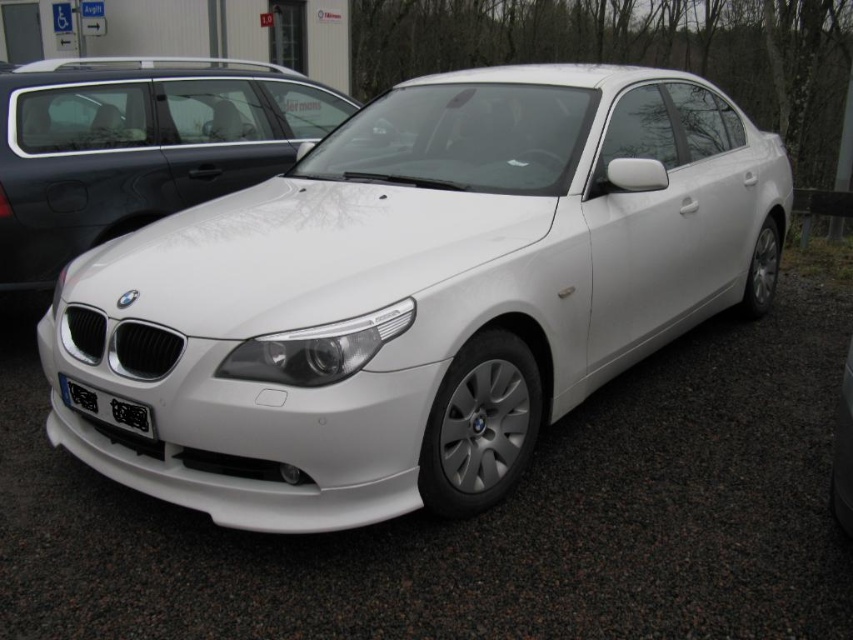
In the scene shown: Does white metallic car at center have a larger size compared to white glossy car at center?

Yes, white metallic car at center is bigger than white glossy car at center.

Does point (157, 410) lie in front of point (695, 380)?

That is True.

Locate an element on the screen. white metallic car at center is located at coordinates (416, 292).

Between white glossy car at center and white glossy sedan at center, which one appears on the left side from the viewer's perspective?

Positioned to the left is white glossy sedan at center.

Where is `white glossy car at center`? white glossy car at center is located at coordinates (486, 516).

Is white glossy car at center to the right of black plastic license plate at front from the viewer's perspective?

Yes, white glossy car at center is to the right of black plastic license plate at front.

Can you confirm if white glossy car at center is positioned above black plastic license plate at front?

No.

Does point (102, 532) come in front of point (137, 419)?

No, (102, 532) is further to viewer.

Image resolution: width=853 pixels, height=640 pixels. In order to click on white glossy car at center in this screenshot , I will do `click(486, 516)`.